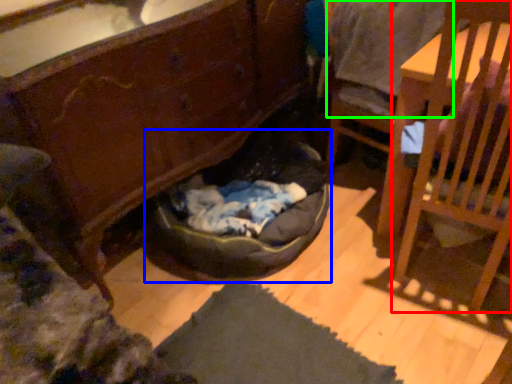
Question: Which object is positioned farthest from chair (highlighted by a red box)? Select from bean bag chair (highlighted by a blue box) and clothing (highlighted by a green box).

Choices:
 (A) bean bag chair
 (B) clothing

Answer: (A)